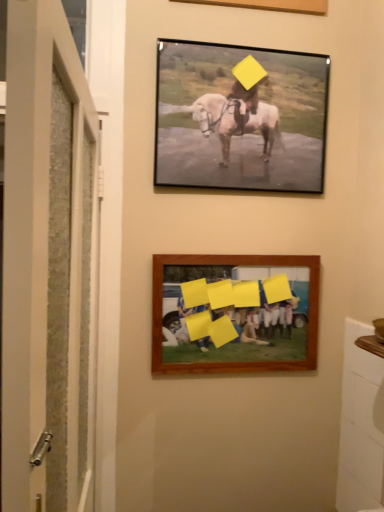
Image resolution: width=384 pixels, height=512 pixels. What do you see at coordinates (48, 264) in the screenshot?
I see `white textured door at left` at bounding box center [48, 264].

What do you see at coordinates (240, 117) in the screenshot? I see `matte black frame at upper center, which ranks as the first picture frame in top-to-bottom order` at bounding box center [240, 117].

What is the approximate height of wooden frame at lower center, which appears as the 2th picture frame when viewed from the top?

The height of wooden frame at lower center, which appears as the 2th picture frame when viewed from the top, is 15.62 inches.

This screenshot has height=512, width=384. I want to click on white textured door at left, so click(x=48, y=264).

Is white textured door at left thinner than matte black frame at upper center, the 2th picture frame ordered from the bottom?

Incorrect, the width of white textured door at left is not less than that of matte black frame at upper center, the 2th picture frame ordered from the bottom.

From a real-world perspective, relative to matte black frame at upper center, which ranks as the first picture frame in top-to-bottom order, is white textured door at left vertically above or below?

In terms of real-world spatial position, white textured door at left is below matte black frame at upper center, which ranks as the first picture frame in top-to-bottom order.

Consider the image. Is white textured door at left behind matte black frame at upper center, which ranks as the first picture frame in top-to-bottom order?

No, white textured door at left is closer to the viewer.

I want to click on door that is under the matte black frame at upper center, the 2th picture frame ordered from the bottom (from a real-world perspective), so click(x=48, y=264).

Is white textured door at left smaller than wooden frame at lower center, placed as the 1th picture frame when sorted from bottom to top?

No, white textured door at left is not smaller than wooden frame at lower center, placed as the 1th picture frame when sorted from bottom to top.

From the image's perspective, is white textured door at left above or below wooden frame at lower center, placed as the 1th picture frame when sorted from bottom to top?

white textured door at left is below wooden frame at lower center, placed as the 1th picture frame when sorted from bottom to top.

Is white textured door at left taller than wooden frame at lower center, which appears as the 2th picture frame when viewed from the top?

Yes, white textured door at left is taller than wooden frame at lower center, which appears as the 2th picture frame when viewed from the top.

Considering the points (20, 222) and (264, 319), which point is in front, point (20, 222) or point (264, 319)?

The point (20, 222) is closer.

Which object is closer to the camera taking this photo, matte black frame at upper center, which ranks as the first picture frame in top-to-bottom order, or white textured door at left?

Positioned in front is white textured door at left.

In terms of width, does matte black frame at upper center, the 2th picture frame ordered from the bottom, look wider or thinner when compared to white textured door at left?

In the image, matte black frame at upper center, the 2th picture frame ordered from the bottom, appears to be more narrow than white textured door at left.

Is matte black frame at upper center, the 2th picture frame ordered from the bottom, located outside white textured door at left?

matte black frame at upper center, the 2th picture frame ordered from the bottom, is positioned outside white textured door at left.

Locate an element on the screen. The height and width of the screenshot is (512, 384). door on the left of matte black frame at upper center, which ranks as the first picture frame in top-to-bottom order is located at coordinates (48, 264).

Based on the photo, considering the sizes of objects wooden frame at lower center, which appears as the 2th picture frame when viewed from the top, and matte black frame at upper center, which ranks as the first picture frame in top-to-bottom order, in the image provided, who is shorter, wooden frame at lower center, which appears as the 2th picture frame when viewed from the top, or matte black frame at upper center, which ranks as the first picture frame in top-to-bottom order,?

wooden frame at lower center, which appears as the 2th picture frame when viewed from the top.

Can you confirm if wooden frame at lower center, which appears as the 2th picture frame when viewed from the top, is smaller than matte black frame at upper center, which ranks as the first picture frame in top-to-bottom order?

Yes, wooden frame at lower center, which appears as the 2th picture frame when viewed from the top, is smaller than matte black frame at upper center, which ranks as the first picture frame in top-to-bottom order.

Is wooden frame at lower center, which appears as the 2th picture frame when viewed from the top, facing towards matte black frame at upper center, the 2th picture frame ordered from the bottom?

No, wooden frame at lower center, which appears as the 2th picture frame when viewed from the top, does not turn towards matte black frame at upper center, the 2th picture frame ordered from the bottom.

Which is farther from the camera, (163, 358) or (178, 170)?

The point (163, 358) is more distant.

I want to click on picture frame below the matte black frame at upper center, the 2th picture frame ordered from the bottom (from the image's perspective), so click(235, 313).

Is matte black frame at upper center, which ranks as the first picture frame in top-to-bottom order, bigger than wooden frame at lower center, which appears as the 2th picture frame when viewed from the top?

Indeed, matte black frame at upper center, which ranks as the first picture frame in top-to-bottom order, has a larger size compared to wooden frame at lower center, which appears as the 2th picture frame when viewed from the top.

Is point (286, 105) farther from viewer compared to point (300, 366)?

No, it is in front of (300, 366).

Considering the sizes of objects matte black frame at upper center, which ranks as the first picture frame in top-to-bottom order, and wooden frame at lower center, which appears as the 2th picture frame when viewed from the top, in the image provided, who is taller, matte black frame at upper center, which ranks as the first picture frame in top-to-bottom order, or wooden frame at lower center, which appears as the 2th picture frame when viewed from the top,?

matte black frame at upper center, which ranks as the first picture frame in top-to-bottom order.

Based on the photo, from a real-world perspective, is wooden frame at lower center, placed as the 1th picture frame when sorted from bottom to top, beneath white textured door at left?

No.

Which is behind, point (195, 272) or point (16, 204)?

Positioned behind is point (195, 272).

Does wooden frame at lower center, placed as the 1th picture frame when sorted from bottom to top, turn towards white textured door at left?

No, wooden frame at lower center, placed as the 1th picture frame when sorted from bottom to top, is not aimed at white textured door at left.

Is the surface of wooden frame at lower center, placed as the 1th picture frame when sorted from bottom to top, in direct contact with white textured door at left?

No, wooden frame at lower center, placed as the 1th picture frame when sorted from bottom to top, is not next to white textured door at left.

Locate an element on the screen. The height and width of the screenshot is (512, 384). door below the matte black frame at upper center, which ranks as the first picture frame in top-to-bottom order (from a real-world perspective) is located at coordinates (48, 264).

Where is `door in front of the wooden frame at lower center, which appears as the 2th picture frame when viewed from the top`? The image size is (384, 512). door in front of the wooden frame at lower center, which appears as the 2th picture frame when viewed from the top is located at coordinates (48, 264).

Estimate the real-world distances between objects in this image. Which object is further from white textured door at left, matte black frame at upper center, which ranks as the first picture frame in top-to-bottom order, or wooden frame at lower center, placed as the 1th picture frame when sorted from bottom to top?

The object further to white textured door at left is matte black frame at upper center, which ranks as the first picture frame in top-to-bottom order.

Looking at this image, which object lies nearer to the anchor point matte black frame at upper center, which ranks as the first picture frame in top-to-bottom order, wooden frame at lower center, which appears as the 2th picture frame when viewed from the top, or white textured door at left?

Based on the image, wooden frame at lower center, which appears as the 2th picture frame when viewed from the top, appears to be nearer to matte black frame at upper center, which ranks as the first picture frame in top-to-bottom order.

When comparing their distances from white textured door at left, does wooden frame at lower center, which appears as the 2th picture frame when viewed from the top, or matte black frame at upper center, the 2th picture frame ordered from the bottom, seem further?

Among the two, matte black frame at upper center, the 2th picture frame ordered from the bottom, is located further to white textured door at left.

From the picture: When comparing their distances from wooden frame at lower center, which appears as the 2th picture frame when viewed from the top, does matte black frame at upper center, which ranks as the first picture frame in top-to-bottom order, or white textured door at left seem further?

white textured door at left is positioned further to the anchor wooden frame at lower center, which appears as the 2th picture frame when viewed from the top.

Looking at the image, which one is located further to wooden frame at lower center, which appears as the 2th picture frame when viewed from the top, white textured door at left or matte black frame at upper center, which ranks as the first picture frame in top-to-bottom order?

white textured door at left is further to wooden frame at lower center, which appears as the 2th picture frame when viewed from the top.

From the image, which object appears to be nearer to matte black frame at upper center, the 2th picture frame ordered from the bottom, white textured door at left or wooden frame at lower center, which appears as the 2th picture frame when viewed from the top?

wooden frame at lower center, which appears as the 2th picture frame when viewed from the top, lies closer to matte black frame at upper center, the 2th picture frame ordered from the bottom, than the other object.

Find the location of `picture frame positioned between white textured door at left and wooden frame at lower center, which appears as the 2th picture frame when viewed from the top, from near to far`. picture frame positioned between white textured door at left and wooden frame at lower center, which appears as the 2th picture frame when viewed from the top, from near to far is located at coordinates (240, 117).